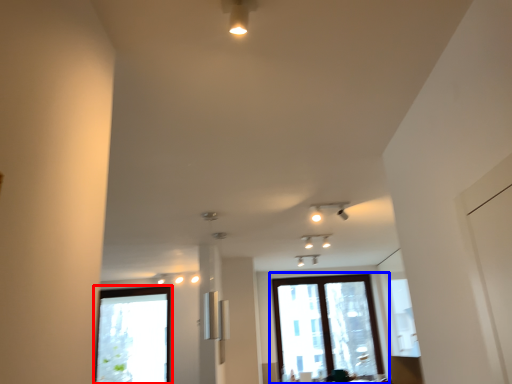
Question: Among these objects, which one is farthest to the camera, window (highlighted by a red box) or window (highlighted by a blue box)?

Choices:
 (A) window
 (B) window

Answer: (B)